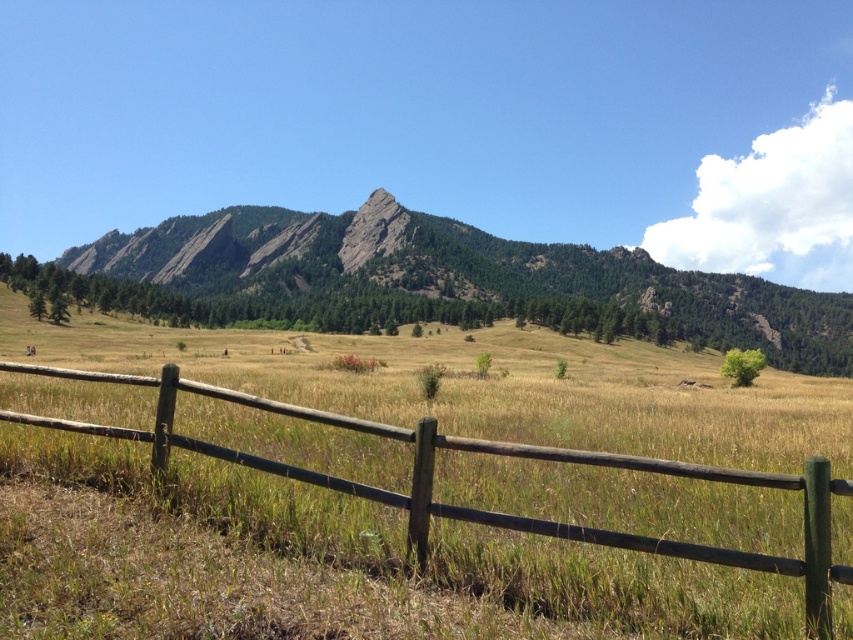
Question: Which point is farther from the camera taking this photo?

Choices:
 (A) click(x=692, y=314)
 (B) click(x=625, y=458)

Answer: (A)

Question: Which point is closer to the camera?

Choices:
 (A) brown wooden fence at lower center
 (B) green grassy mountain at center

Answer: (A)

Question: Does green grassy mountain at center appear under brown wooden fence at lower center?

Choices:
 (A) yes
 (B) no

Answer: (B)

Question: Is green grassy mountain at center to the right of brown wooden fence at lower center from the viewer's perspective?

Choices:
 (A) no
 (B) yes

Answer: (A)

Question: Which object appears closest to the camera in this image?

Choices:
 (A) brown wooden fence at lower center
 (B) green grassy mountain at center

Answer: (A)

Question: In this image, where is green grassy mountain at center located relative to brown wooden fence at lower center?

Choices:
 (A) above
 (B) below

Answer: (A)